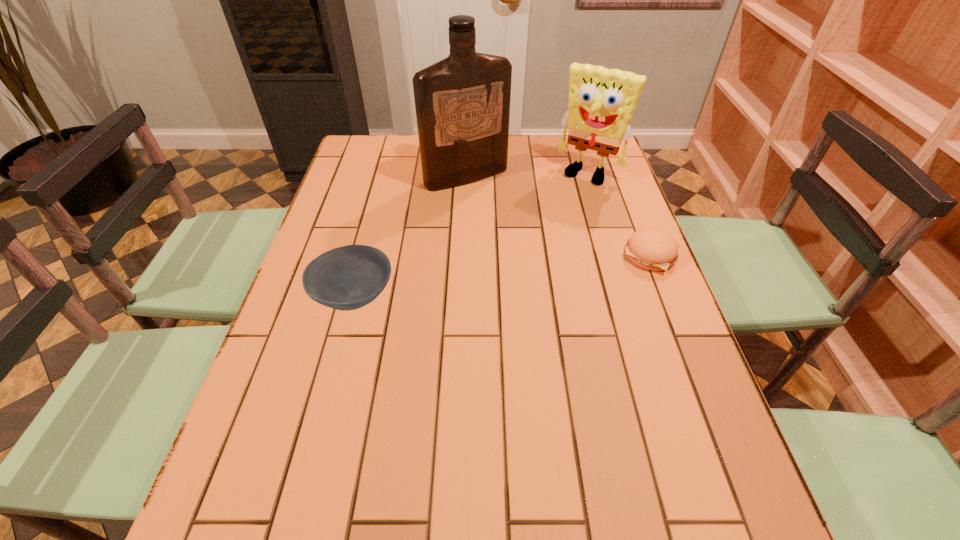
Identify the location of vacant area that lies between the tallest object and the third tallest object. This screenshot has height=540, width=960. (410, 237).

Identify the location of free space between the third object from right to left and the bowl. (410, 237).

The image size is (960, 540). I want to click on free spot between the patty and the bowl, so click(503, 276).

Locate an element on the screen. Image resolution: width=960 pixels, height=540 pixels. vacant point located between the patty and the third tallest object is located at coordinates (503, 276).

Identify the location of vacant space that's between the sponge and the third object from right to left. (527, 175).

The width and height of the screenshot is (960, 540). In order to click on free space between the second shortest object and the liquor in this screenshot , I will do `click(410, 237)`.

Point out which object is positioned as the second nearest to the sponge. Please provide its 2D coordinates. Your answer should be formatted as a tuple, i.e. [(x, y)], where the tuple contains the x and y coordinates of a point satisfying the conditions above.

[(652, 249)]

Locate which object is the closest to the bowl. Please provide its 2D coordinates. Your answer should be formatted as a tuple, i.e. [(x, y)], where the tuple contains the x and y coordinates of a point satisfying the conditions above.

[(462, 102)]

Where is `vacant area in the image that satisfies the following two spatial constraints: 1. on the front side of the sponge; 2. on the right side of the shortest object`? The width and height of the screenshot is (960, 540). vacant area in the image that satisfies the following two spatial constraints: 1. on the front side of the sponge; 2. on the right side of the shortest object is located at coordinates (613, 256).